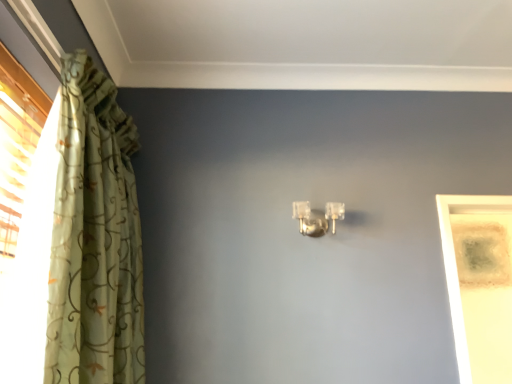
In the scene shown: Measure the distance between point (96, 361) and camera.

Point (96, 361) and camera are 4.10 feet apart.

The image size is (512, 384). What do you see at coordinates (94, 237) in the screenshot? I see `green floral fabric curtain at left` at bounding box center [94, 237].

Identify the location of green floral fabric curtain at left. The height and width of the screenshot is (384, 512). (94, 237).

The width and height of the screenshot is (512, 384). I want to click on green floral fabric curtain at left, so click(94, 237).